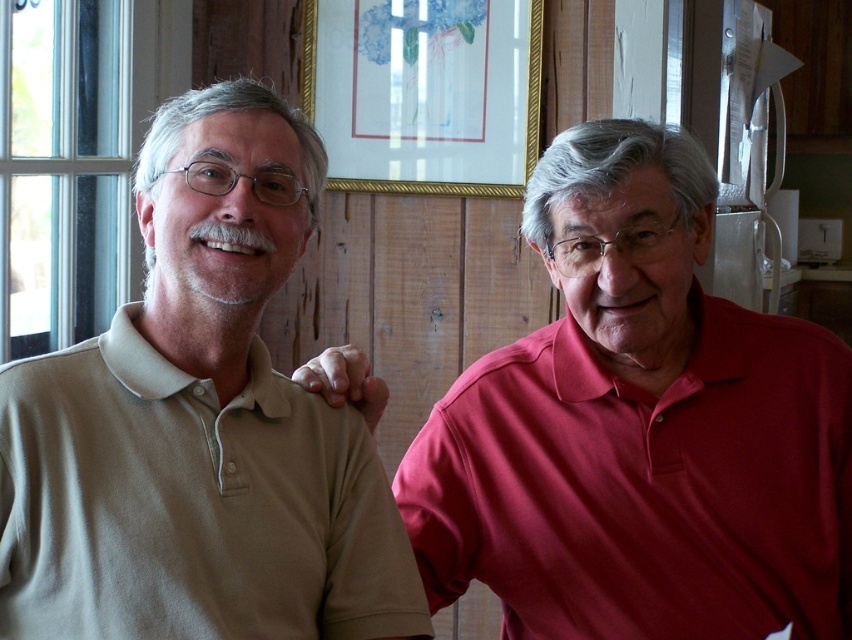
Question: Can you confirm if matte red polo shirt at right is positioned to the right of gold-framed picture at upper center?

Choices:
 (A) yes
 (B) no

Answer: (A)

Question: Estimate the real-world distances between objects in this image. Which object is closer to the matte red polo shirt at right?

Choices:
 (A) beige cotton polo shirt at left
 (B) gold-framed picture at upper center

Answer: (A)

Question: Which point is closer to the camera taking this photo?

Choices:
 (A) (229, 272)
 (B) (802, 496)
 (C) (422, 122)

Answer: (A)

Question: Estimate the real-world distances between objects in this image. Which object is closer to the gold-framed picture at upper center?

Choices:
 (A) matte red polo shirt at right
 (B) beige cotton polo shirt at left

Answer: (A)

Question: Does beige cotton polo shirt at left come in front of matte red polo shirt at right?

Choices:
 (A) no
 (B) yes

Answer: (B)

Question: Where is beige cotton polo shirt at left located in relation to gold-framed picture at upper center in the image?

Choices:
 (A) right
 (B) left

Answer: (B)